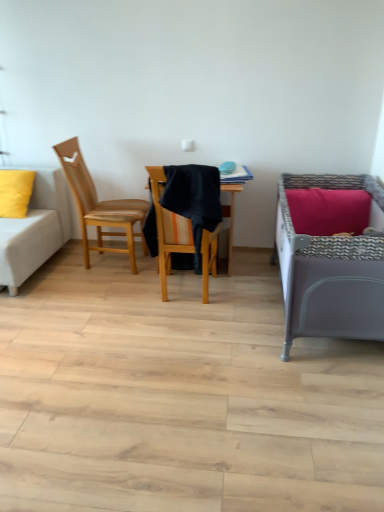
This screenshot has height=512, width=384. I want to click on vacant space that is to the left of gray fabric infant bed at right, so click(194, 331).